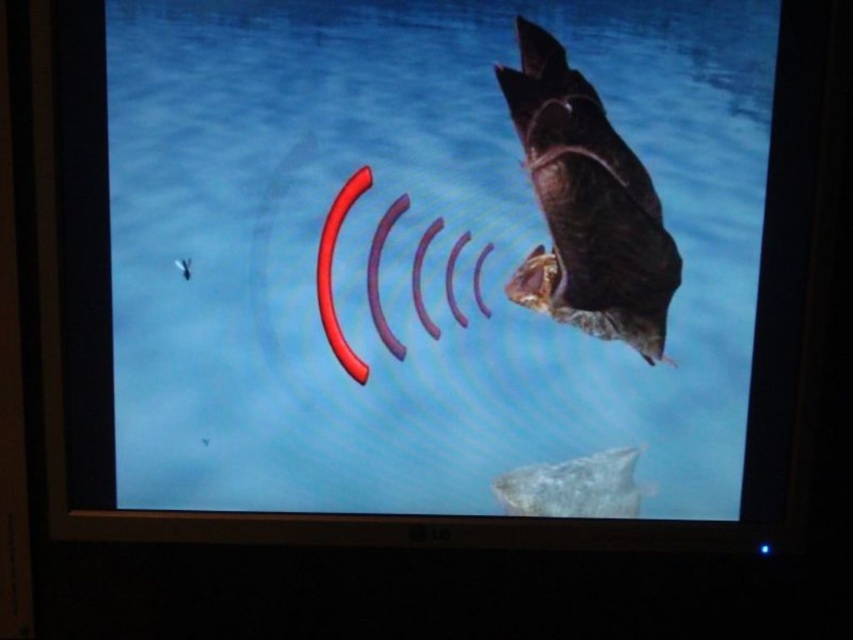
You are observing the bat creature in the video game scene. There are two points marked in the image. Which point is closer to you, point (563, 294) or point (630, 516)?

Point (563, 294) is closer to the camera than point (630, 516).

You are a predator in the game and need to decide which fish to target first. The shiny metallic fish at right and the smooth gray fish at bottom center are both visible. Based on their positions, which fish is closer to the left edge of the screen?

The shiny metallic fish at right is positioned on the left side of smooth gray fish at bottom center, so the shiny metallic fish at right is closer to the left edge of the screen.